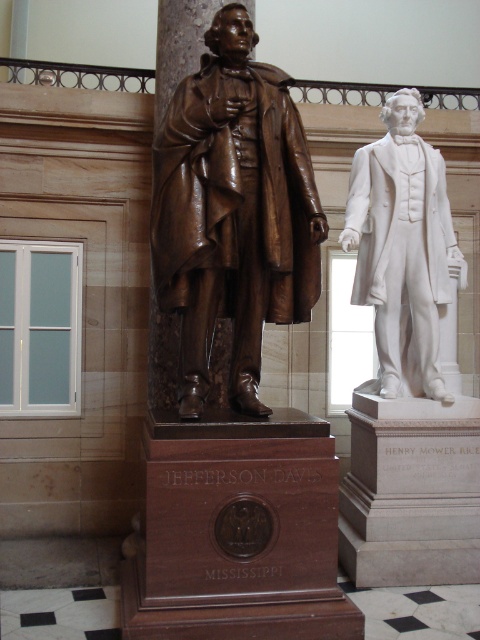
Which of these two, bronze statue at center or white marble statue at right, stands shorter?

bronze statue at center is shorter.

Does point (192, 145) come behind point (358, 205)?

No, (192, 145) is closer to viewer.

At what (x,y) coordinates should I click in order to perform the action: click on bronze statue at center. Please return your answer as a coordinate pair (x, y). This screenshot has width=480, height=640. Looking at the image, I should click on (232, 211).